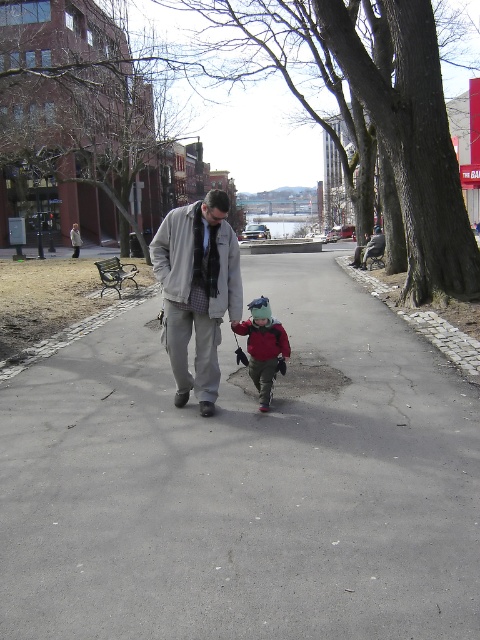
Question: Is gray woolen jacket at center closer to camera compared to matte red jacket at center?

Choices:
 (A) yes
 (B) no

Answer: (A)

Question: Does gray asphalt pavement at center appear over matte red jacket at center?

Choices:
 (A) yes
 (B) no

Answer: (B)

Question: Which object is closer to the camera taking this photo?

Choices:
 (A) matte red jacket at center
 (B) gray asphalt pavement at center

Answer: (B)

Question: Considering the real-world distances, which object is closest to the matte red jacket at center?

Choices:
 (A) gray asphalt pavement at center
 (B) gray woolen jacket at center

Answer: (B)

Question: Is gray woolen jacket at center thinner than matte red jacket at center?

Choices:
 (A) yes
 (B) no

Answer: (B)

Question: Which point appears closest to the camera in this image?

Choices:
 (A) coord(251,332)
 (B) coord(108,369)
 (C) coord(155,243)

Answer: (C)